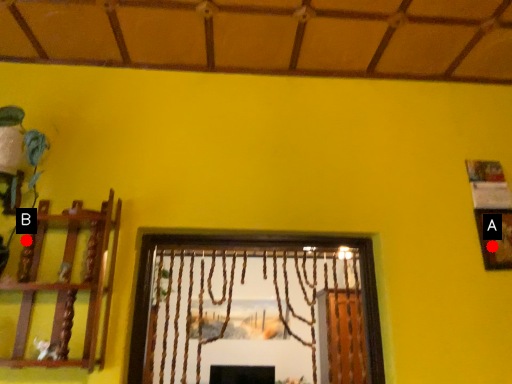
Question: Two points are circled on the image, labeled by A and B beside each circle. Which point is closer to the camera?

Choices:
 (A) A is closer
 (B) B is closer

Answer: (B)